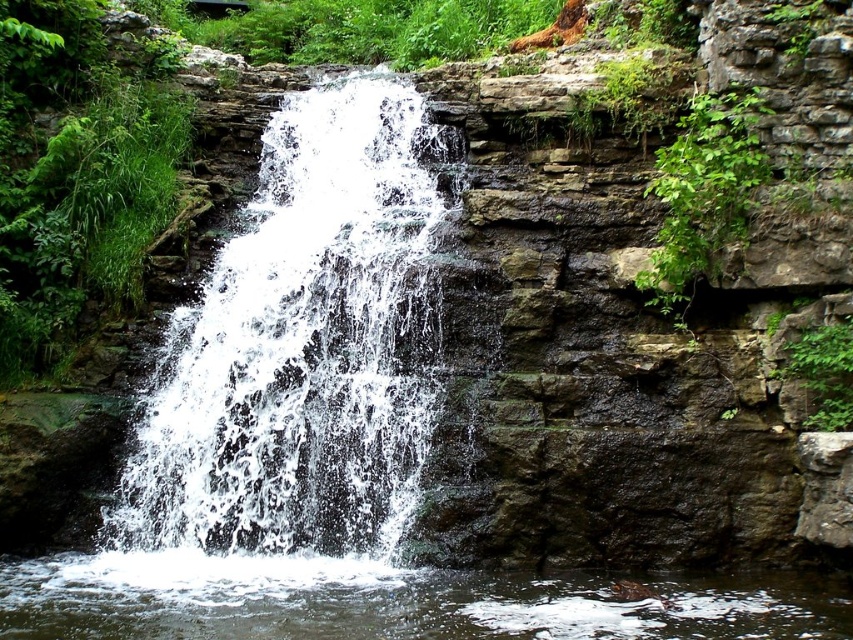
Question: Is white frothy water at center wider than clear water at bottom center?

Choices:
 (A) no
 (B) yes

Answer: (A)

Question: Is white frothy water at center closer to the viewer compared to clear water at bottom center?

Choices:
 (A) yes
 (B) no

Answer: (B)

Question: Which object is closer to the camera taking this photo?

Choices:
 (A) clear water at bottom center
 (B) white frothy water at center

Answer: (A)

Question: Does white frothy water at center have a larger size compared to clear water at bottom center?

Choices:
 (A) yes
 (B) no

Answer: (A)

Question: Among these points, which one is farthest from the camera?

Choices:
 (A) pyautogui.click(x=804, y=628)
 (B) pyautogui.click(x=190, y=339)

Answer: (B)